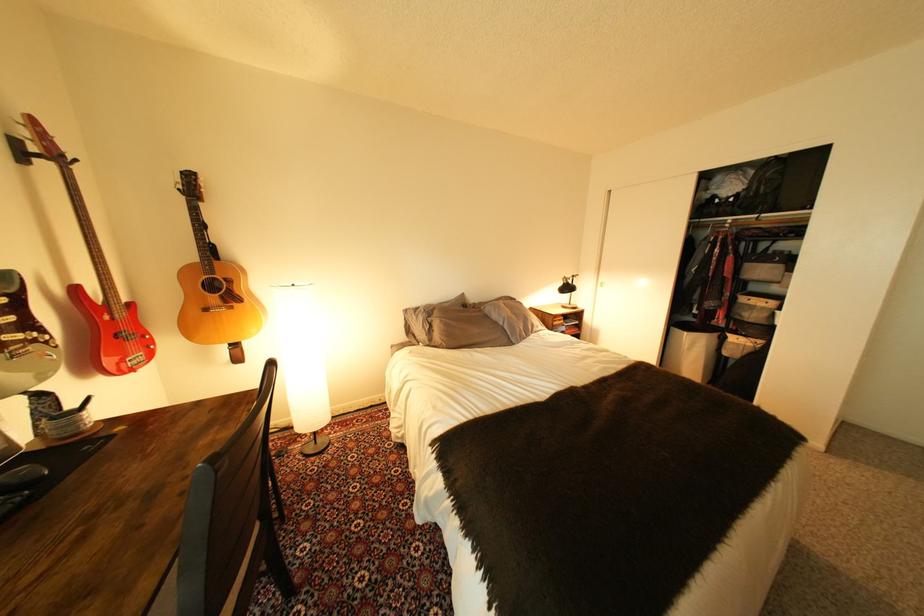
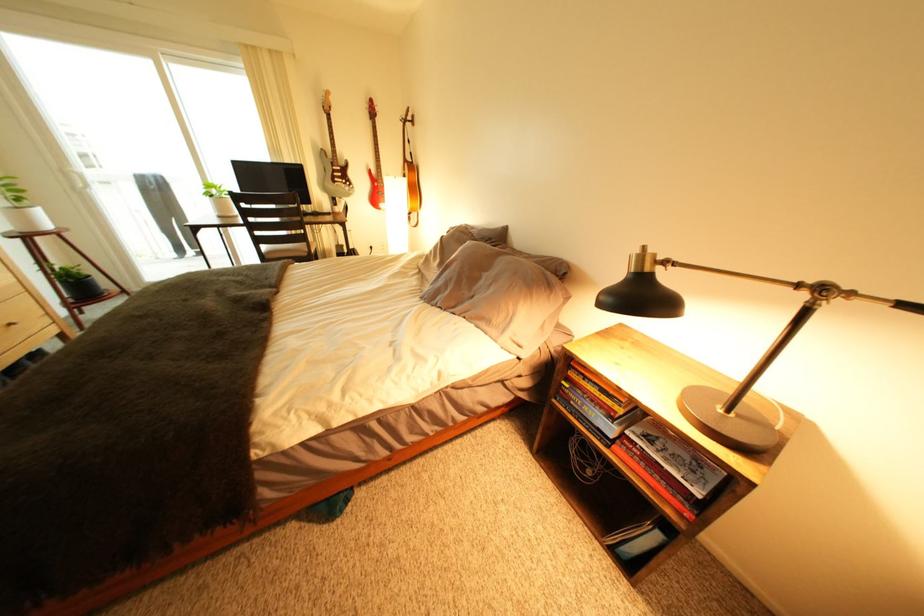
The point at (26, 350) is marked in the first image. Where is the corresponding point in the second image?

(349, 185)